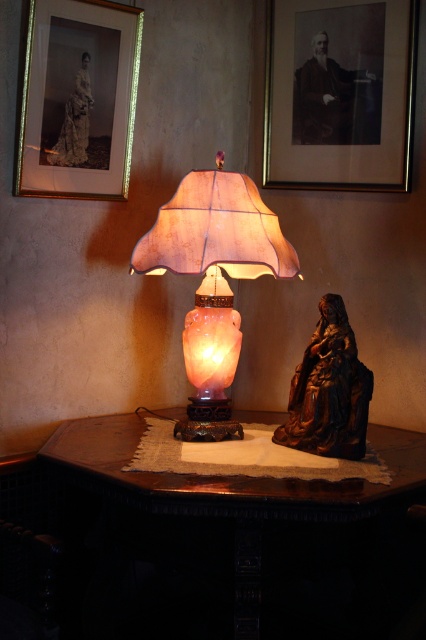
Can you confirm if wooden table at center is positioned below pink alabaster lamp at center?

Correct, wooden table at center is located below pink alabaster lamp at center.

Is wooden table at center bigger than pink alabaster lamp at center?

Yes, wooden table at center is bigger than pink alabaster lamp at center.

Does point (331, 589) come closer to viewer compared to point (226, 205)?

No, (331, 589) is further to viewer.

Locate an element on the screen. wooden table at center is located at coordinates (232, 545).

From the picture: Is wooden table at center positioned before black paper portrait at upper center?

Yes, wooden table at center is in front of black paper portrait at upper center.

Does wooden table at center have a smaller size compared to black paper portrait at upper center?

Actually, wooden table at center might be larger than black paper portrait at upper center.

Between point (167, 483) and point (380, 28), which one is positioned behind?

The point (380, 28) is behind.

This screenshot has height=640, width=426. I want to click on wooden table at center, so click(232, 545).

Find the location of a particular element. Image resolution: width=426 pixels, height=640 pixels. black paper portrait at upper center is located at coordinates (339, 93).

Is black paper portrait at upper center above bronze statue at right?

Yes.

Locate an element on the screen. This screenshot has width=426, height=640. black paper portrait at upper center is located at coordinates (339, 93).